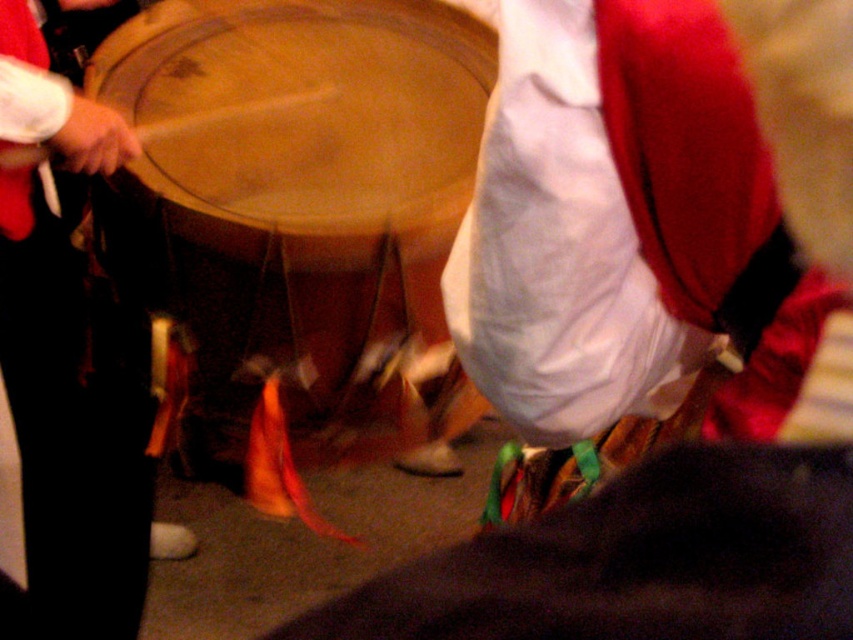
Between wooden drum at center and matte black drum at center, which one is positioned lower?

matte black drum at center

Does wooden drum at center have a greater height compared to matte black drum at center?

Incorrect, wooden drum at center's height is not larger of matte black drum at center's.

Does point (397, 369) come in front of point (91, 172)?

No.

Find the location of `wooden drum at center`. wooden drum at center is located at coordinates (309, 212).